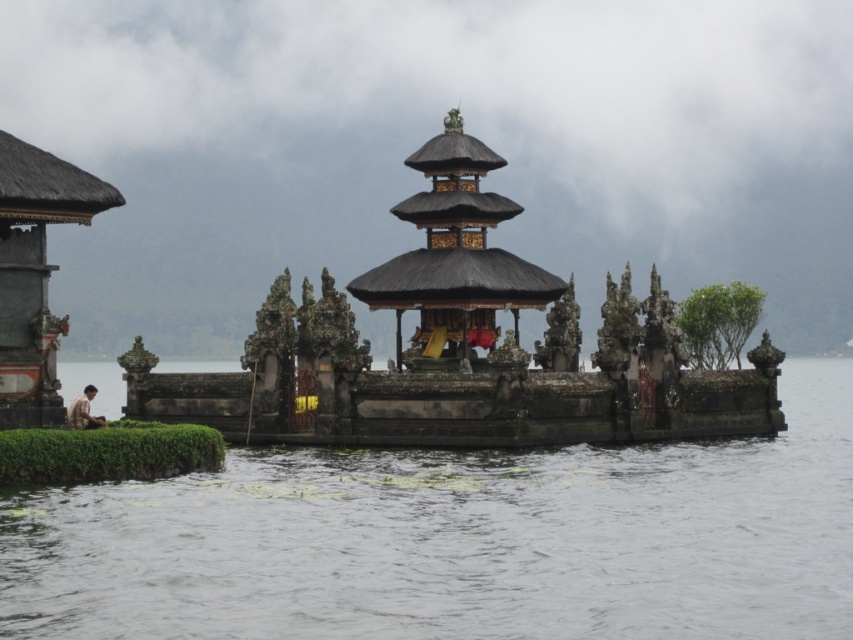
You are standing at the entrance of the Balinese temple and notice the matte black gazebo at left and the brown fabric person at lower left. Which object is closer to you from your current position?

Result: The brown fabric person at lower left is closer to you because the matte black gazebo at left is positioned over it, indicating it is further away.

You are a visitor standing at the edge of the temple grounds. You want to take a photo of the dark brown wooden gazebo at center but need to ensure the clear water at lower center doesn t block your view. Can you position yourself so that the gazebo is fully visible without the water obstructing it?

The clear water at lower center is not as tall as the dark brown wooden gazebo at center, so positioning yourself at a higher angle or moving to a spot where you can look over the water will allow the gazebo to be fully visible without obstruction.

You are standing at the entrance of the temple and want to reach both the point at coordinates point (x=544, y=413) and point (x=36, y=342). Which point will you reach first as you move towards them?

You will reach point (x=36, y=342) first because it is closer to you than point (x=544, y=413), which is further away.